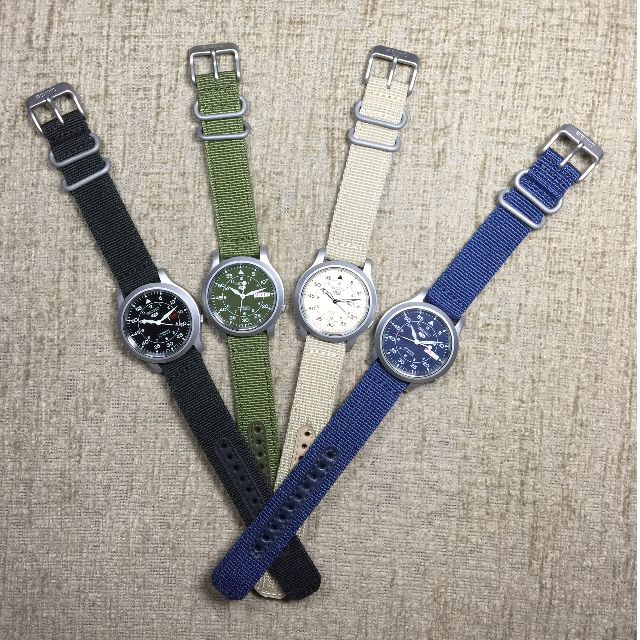
Where is `carpet`? This screenshot has width=640, height=640. carpet is located at coordinates (472, 483).